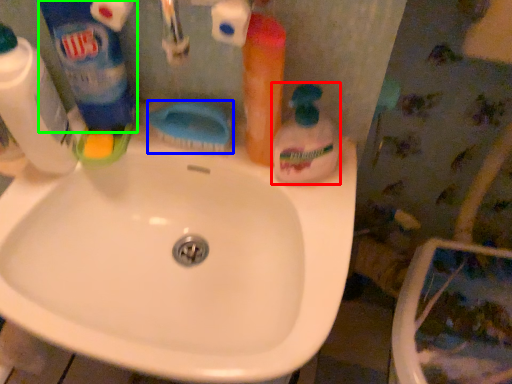
Question: Which object is the farthest from cleaning product (highlighted by a red box)? Choose among these: brush (highlighted by a blue box) or cleaning product (highlighted by a green box).

Choices:
 (A) brush
 (B) cleaning product

Answer: (B)